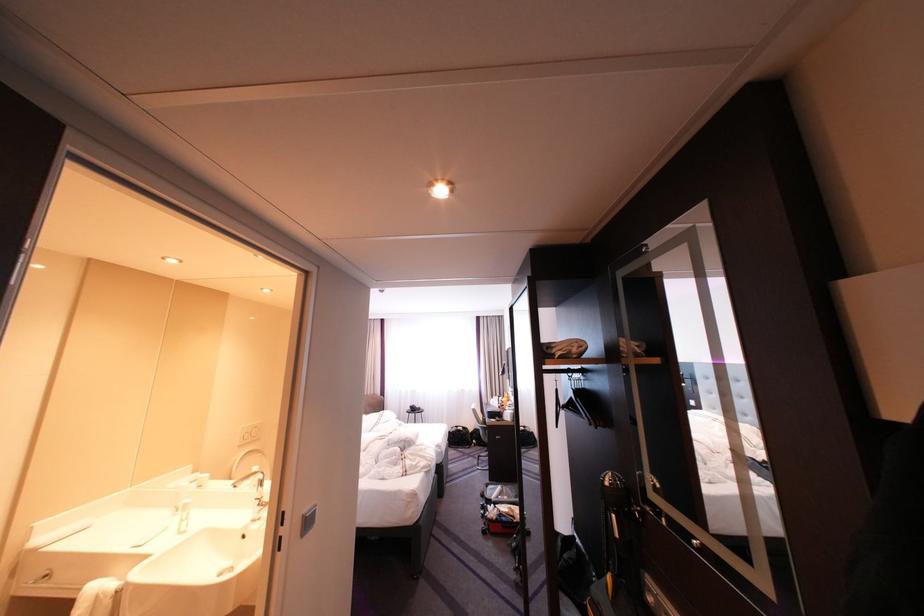
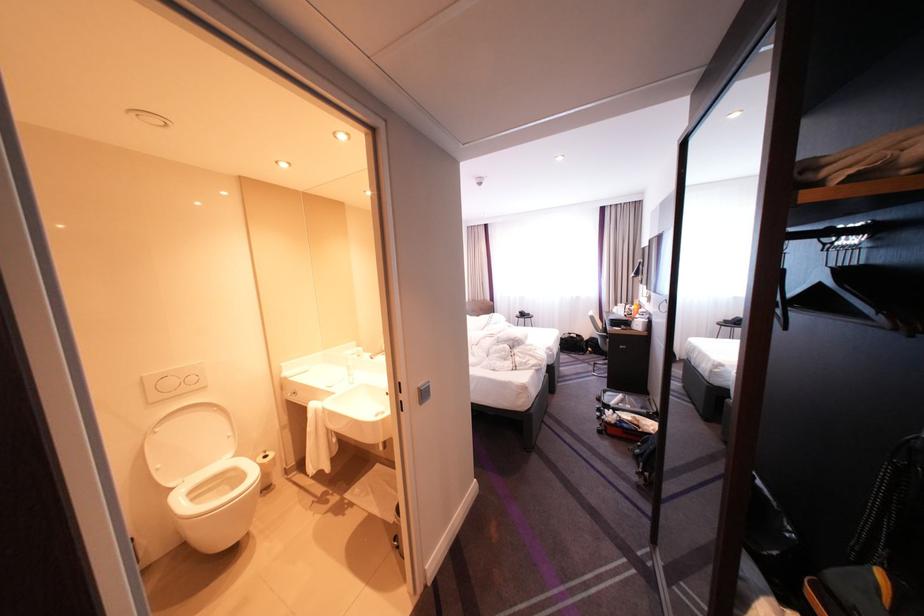
The point at (482, 430) is marked in the first image. Where is the corresponding point in the second image?

(599, 338)